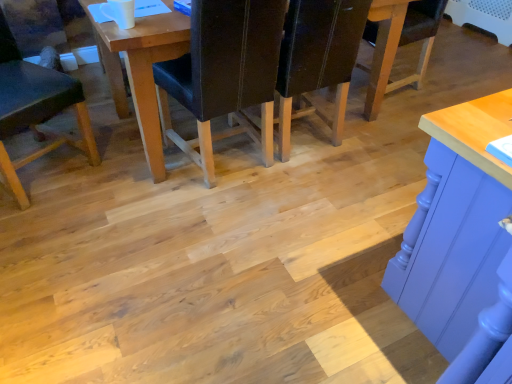
In order to click on vacant space that's between wooden table at center and matte black chair at lower left, the third chair in the right-to-left sequence in this screenshot , I will do `click(101, 172)`.